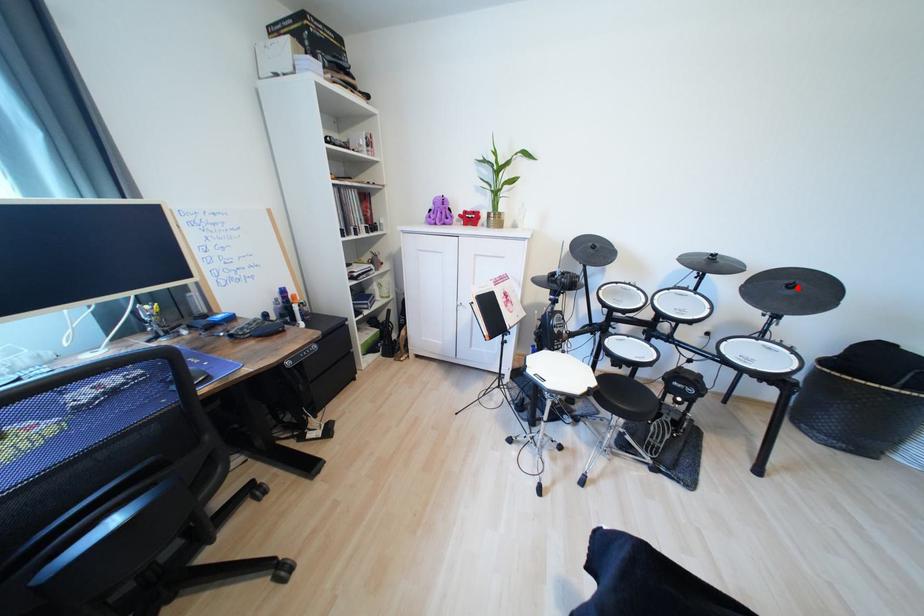
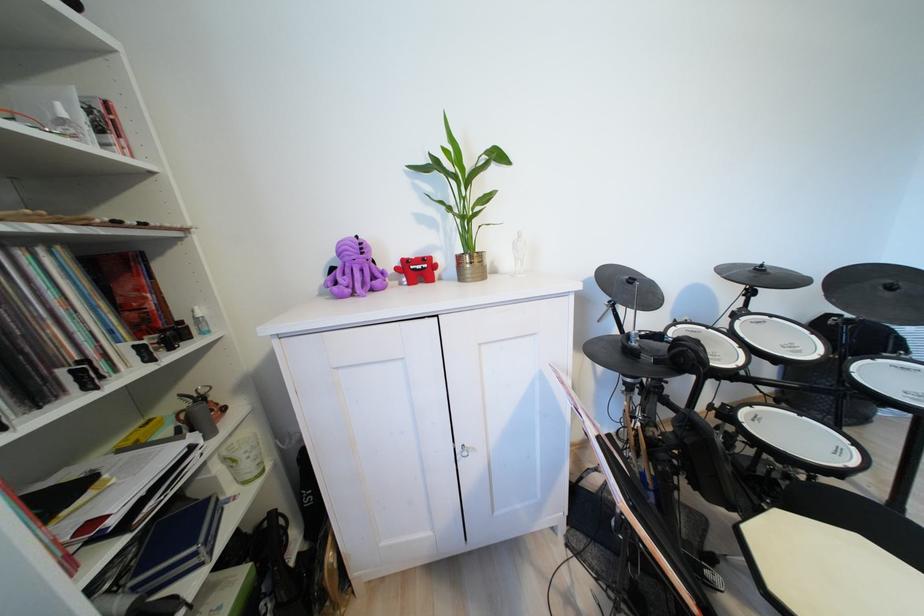
Question: I am providing you with two images of the same scene from different viewpoints. Given a red point in image1, look at the same physical point in image2. Is it:

Choices:
 (A) Closer to the viewpoint
 (B) Farther from the viewpoint

Answer: (A)